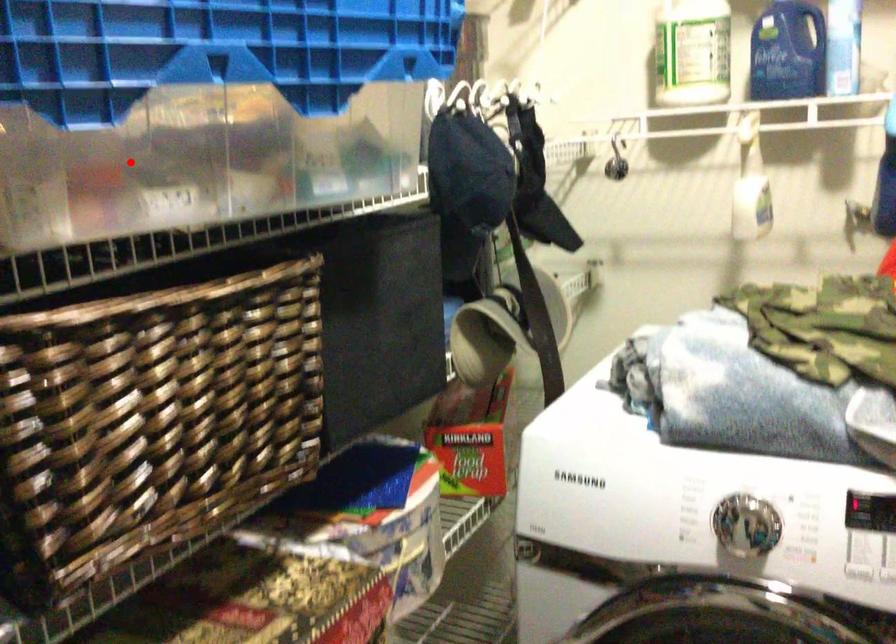
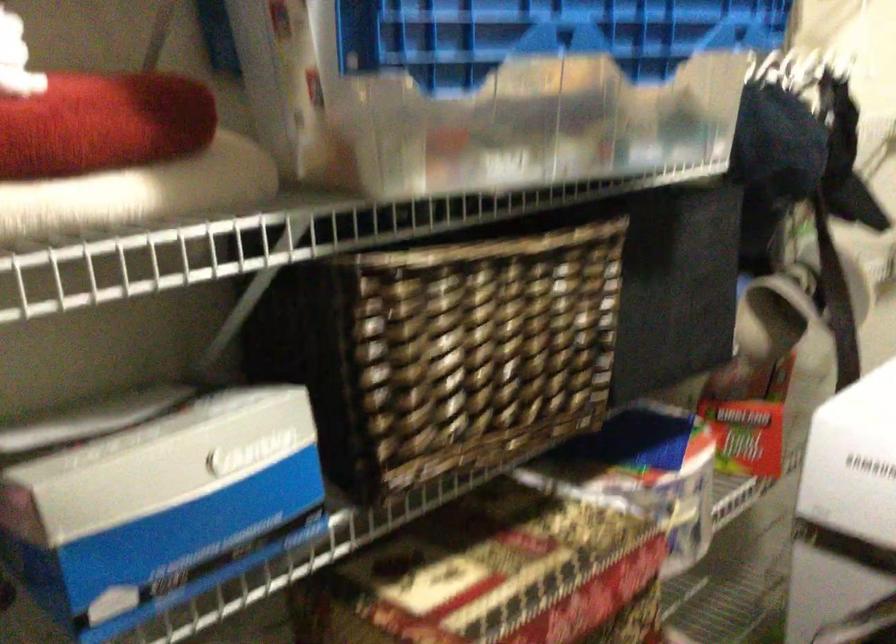
In the second image, find the point that corresponds to the highlighted location in the first image.

(468, 114)